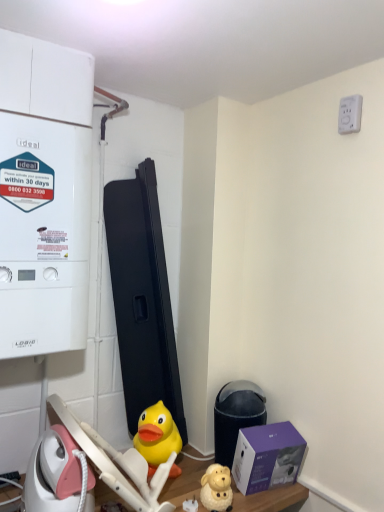
Question: Is yellow rubber duck at center, which is the second toy in front-to-back order, taller than black plastic water heater at lower right?

Choices:
 (A) yes
 (B) no

Answer: (B)

Question: Are yellow rubber duck at center, placed as the second toy when sorted from right to left, and black plastic water heater at lower right making contact?

Choices:
 (A) no
 (B) yes

Answer: (A)

Question: From a real-world perspective, is yellow rubber duck at center, placed as the second toy when sorted from right to left, on black plastic water heater at lower right?

Choices:
 (A) yes
 (B) no

Answer: (B)

Question: Is yellow rubber duck at center, placed as the second toy when sorted from right to left, behind black plastic water heater at lower right?

Choices:
 (A) yes
 (B) no

Answer: (B)

Question: From a real-world perspective, is yellow rubber duck at center, the 1th toy when ordered from back to front, located beneath black plastic water heater at lower right?

Choices:
 (A) yes
 (B) no

Answer: (A)

Question: Considering the relative positions of purple matte box at lower right and white matte boiler at left in the image provided, is purple matte box at lower right to the left or to the right of white matte boiler at left?

Choices:
 (A) right
 (B) left

Answer: (A)

Question: Based on their sizes in the image, would you say purple matte box at lower right is bigger or smaller than white matte boiler at left?

Choices:
 (A) small
 (B) big

Answer: (A)

Question: Considering the positions of purple matte box at lower right and white matte boiler at left in the image, is purple matte box at lower right wider or thinner than white matte boiler at left?

Choices:
 (A) wide
 (B) thin

Answer: (B)

Question: Is purple matte box at lower right in front of or behind white matte boiler at left in the image?

Choices:
 (A) behind
 (B) front

Answer: (A)

Question: Is white matte boiler at left inside or outside of black plastic water heater at lower right?

Choices:
 (A) outside
 (B) inside

Answer: (A)

Question: Is point (19, 184) positioned closer to the camera than point (213, 420)?

Choices:
 (A) closer
 (B) farther

Answer: (A)

Question: In the image, is white matte boiler at left on the left side or the right side of black plastic water heater at lower right?

Choices:
 (A) right
 (B) left

Answer: (B)

Question: Looking at the image, does white matte boiler at left seem bigger or smaller compared to black plastic water heater at lower right?

Choices:
 (A) big
 (B) small

Answer: (A)

Question: Relative to purple matte box at lower right, is black plastic water heater at lower right in front or behind?

Choices:
 (A) front
 (B) behind

Answer: (B)

Question: Is black plastic water heater at lower right wider or thinner than purple matte box at lower right?

Choices:
 (A) thin
 (B) wide

Answer: (A)